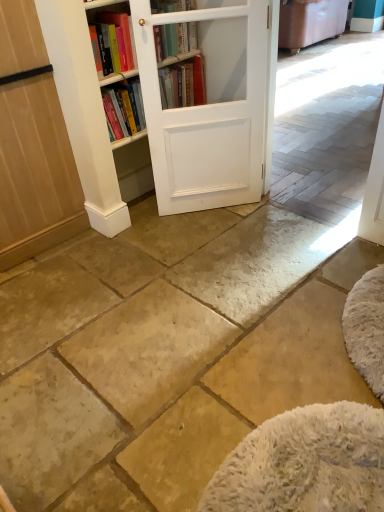
This screenshot has width=384, height=512. I want to click on vacant area in front of white matte barn door at center, so click(213, 239).